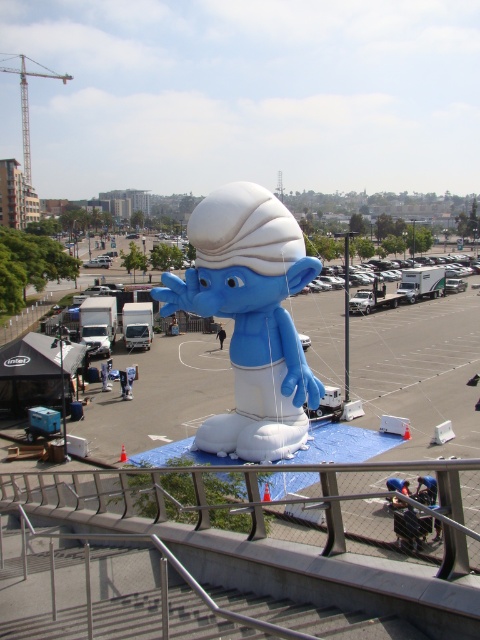
Question: Which object is positioned farthest from the blue inflatable smurf at center?

Choices:
 (A) satin silver railing at center
 (B) white matte inflatable at center
 (C) metallic construction crane at upper left

Answer: (C)

Question: Does white matte inflatable at center have a lesser width compared to metallic construction crane at upper left?

Choices:
 (A) no
 (B) yes

Answer: (B)

Question: Is blue inflatable smurf at center below metallic construction crane at upper left?

Choices:
 (A) no
 (B) yes

Answer: (B)

Question: Which of these objects is positioned farthest from the metallic construction crane at upper left?

Choices:
 (A) white matte inflatable at center
 (B) satin silver railing at center

Answer: (B)

Question: Which is farther from the blue inflatable smurf at center?

Choices:
 (A) metallic construction crane at upper left
 (B) satin silver railing at center

Answer: (A)

Question: Can you confirm if satin silver railing at center is bigger than white matte inflatable at center?

Choices:
 (A) yes
 (B) no

Answer: (A)